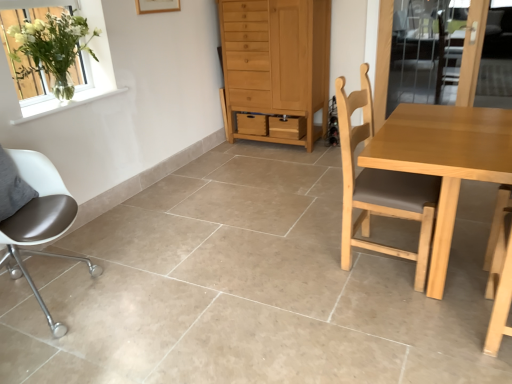
Question: Is light brown wooden table at right oriented towards clear glass screen door at upper right?

Choices:
 (A) yes
 (B) no

Answer: (B)

Question: From the image's perspective, does light brown wooden table at right appear lower than clear glass screen door at upper right?

Choices:
 (A) no
 (B) yes

Answer: (B)

Question: Can you confirm if light brown wooden table at right is wider than clear glass screen door at upper right?

Choices:
 (A) yes
 (B) no

Answer: (A)

Question: Is light brown wooden table at right directly adjacent to clear glass screen door at upper right?

Choices:
 (A) yes
 (B) no

Answer: (B)

Question: From a real-world perspective, is light brown wooden table at right positioned under clear glass screen door at upper right based on gravity?

Choices:
 (A) no
 (B) yes

Answer: (B)

Question: Is light brown wood cabinet at center spatially inside light brown wood chair at center, positioned as the second chair in left-to-right order, or outside of it?

Choices:
 (A) inside
 (B) outside

Answer: (B)

Question: From their relative heights in the image, would you say light brown wood cabinet at center is taller or shorter than light brown wood chair at center, the 1th chair in the right-to-left sequence?

Choices:
 (A) tall
 (B) short

Answer: (A)

Question: Considering their positions, is light brown wood cabinet at center located in front of or behind light brown wood chair at center, the 1th chair in the right-to-left sequence?

Choices:
 (A) front
 (B) behind

Answer: (B)

Question: From a real-world perspective, relative to light brown wood chair at center, positioned as the second chair in left-to-right order, is light brown wood cabinet at center vertically above or below?

Choices:
 (A) below
 (B) above

Answer: (B)

Question: Considering the positions of matte brown chair at left, positioned as the 2th chair in right-to-left order, and clear glass screen door at upper right in the image, is matte brown chair at left, positioned as the 2th chair in right-to-left order, wider or thinner than clear glass screen door at upper right?

Choices:
 (A) thin
 (B) wide

Answer: (B)

Question: From a real-world perspective, is matte brown chair at left, the first chair when ordered from left to right, above or below clear glass screen door at upper right?

Choices:
 (A) below
 (B) above

Answer: (A)

Question: Is point (17, 223) closer or farther from the camera than point (455, 79)?

Choices:
 (A) farther
 (B) closer

Answer: (B)

Question: In the image, is matte brown chair at left, the first chair when ordered from left to right, on the left side or the right side of clear glass screen door at upper right?

Choices:
 (A) left
 (B) right

Answer: (A)

Question: From their relative heights in the image, would you say light brown wooden table at right is taller or shorter than matte brown chair at left, positioned as the 2th chair in right-to-left order?

Choices:
 (A) tall
 (B) short

Answer: (B)

Question: Choose the correct answer: Is light brown wooden table at right inside matte brown chair at left, positioned as the 2th chair in right-to-left order, or outside it?

Choices:
 (A) outside
 (B) inside

Answer: (A)